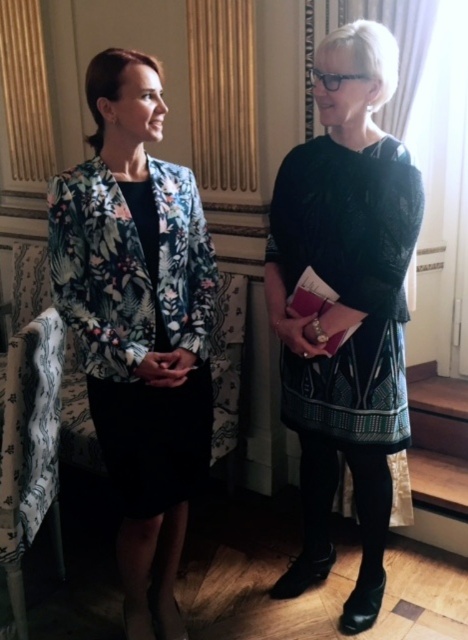
Question: Is dark green textured dress at center below patterned fabric armchair at lower left?

Choices:
 (A) no
 (B) yes

Answer: (A)

Question: Which point is closer to the camera?

Choices:
 (A) floral-patterned blazer at left
 (B) dark green textured dress at center

Answer: (A)

Question: Considering the real-world distances, which object is closest to the floral-patterned blazer at left?

Choices:
 (A) dark green textured dress at center
 (B) patterned fabric armchair at lower left

Answer: (B)

Question: Is floral-patterned blazer at left above patterned fabric armchair at lower left?

Choices:
 (A) no
 (B) yes

Answer: (B)

Question: Which point is closer to the camera?

Choices:
 (A) patterned fabric armchair at lower left
 (B) dark green textured dress at center

Answer: (A)

Question: Can you confirm if dark green textured dress at center is wider than patterned fabric armchair at lower left?

Choices:
 (A) no
 (B) yes

Answer: (B)